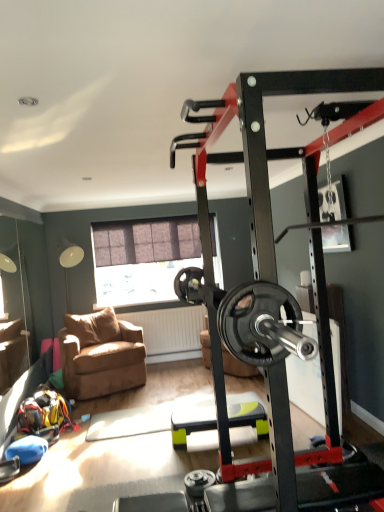
Question: From a real-world perspective, relative to brown fabric chair at lower left, is black rubber weight at center vertically above or below?

Choices:
 (A) below
 (B) above

Answer: (B)

Question: Is black rubber weight at center wider or thinner than brown fabric chair at lower left?

Choices:
 (A) wide
 (B) thin

Answer: (A)

Question: Considering the real-world distances, which object is closest to the brown fabric chair at lower left?

Choices:
 (A) matte brown window at center
 (B) green plastic step platform at center
 (C) black rubber weight at center

Answer: (A)

Question: Which object is the closest to the black rubber weight at center?

Choices:
 (A) brown fabric chair at lower left
 (B) green plastic step platform at center
 (C) matte brown window at center

Answer: (B)